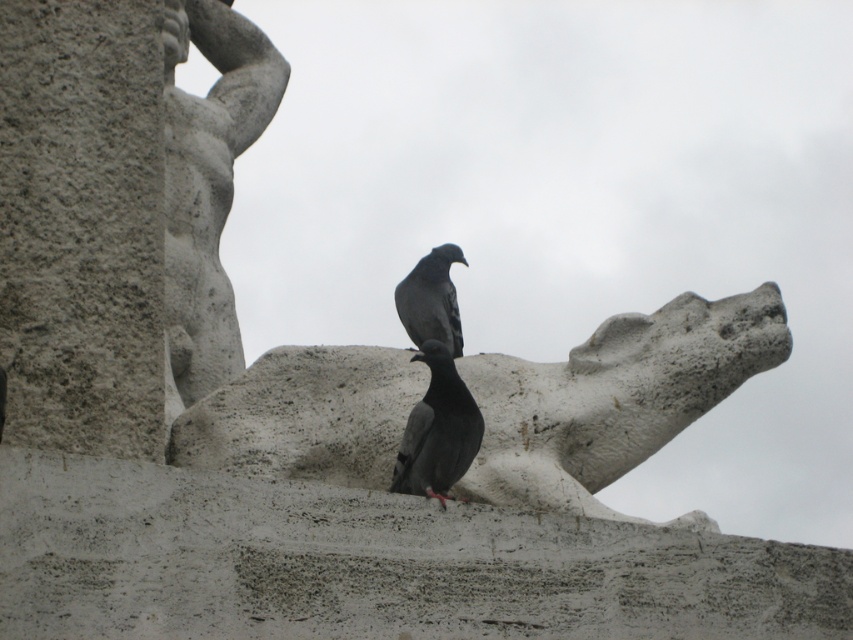
Which of these two, gray stone statue at upper left or matte gray pigeon at center, stands taller?

Standing taller between the two is gray stone statue at upper left.

Between gray stone statue at upper left and matte gray pigeon at center, which one appears on the left side from the viewer's perspective?

From the viewer's perspective, gray stone statue at upper left appears more on the left side.

Is point (231, 109) positioned after point (462, 342)?

That is True.

Locate an element on the screen. The image size is (853, 640). gray stone statue at upper left is located at coordinates (207, 180).

Find the location of `gray stone gargoyle at center`. gray stone gargoyle at center is located at coordinates (370, 564).

Which of these two, gray stone gargoyle at center or gray stone statue at upper left, stands shorter?

With less height is gray stone gargoyle at center.

Between point (33, 584) and point (194, 145), which one is positioned in front?

Point (33, 584) is more forward.

Locate an element on the screen. gray stone gargoyle at center is located at coordinates (370, 564).

Is gray matte pigeon at center thinner than matte gray pigeon at center?

Correct, gray matte pigeon at center's width is less than matte gray pigeon at center's.

Based on the photo, does gray matte pigeon at center appear over matte gray pigeon at center?

Result: No, gray matte pigeon at center is not above matte gray pigeon at center.

Describe the element at coordinates (437, 429) in the screenshot. I see `gray matte pigeon at center` at that location.

I want to click on gray matte pigeon at center, so click(437, 429).